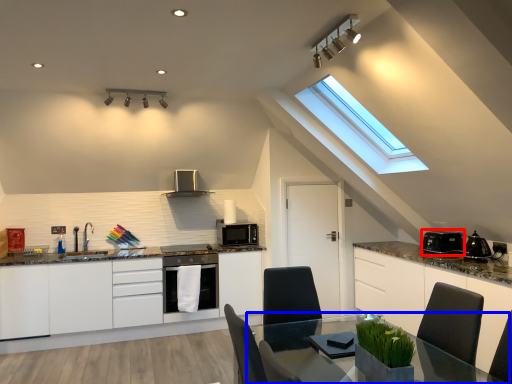
Question: Which object is further to the camera taking this photo, appliance (highlighted by a red box) or table (highlighted by a blue box)?

Choices:
 (A) appliance
 (B) table

Answer: (A)